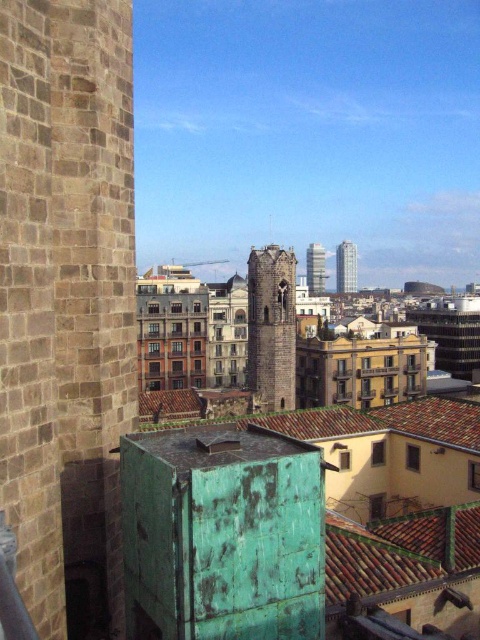
From the picture: You are a photographer planning to capture a shot of both the brown stone tower at center and the glassy reflective skyscraper at center. Based on their positions, which one would appear larger in the photo?

The brown stone tower at center appears larger in the photo because it is closer to the camera than the glassy reflective skyscraper at center, which is positioned further away.

You are an urban planner assessing the city skyline. You notice the brown stone tower at center and the glassy reflective skyscraper at upper right. Which structure appears to be the larger one in the image?

The glassy reflective skyscraper at upper right is larger than the brown stone tower at center according to the description.